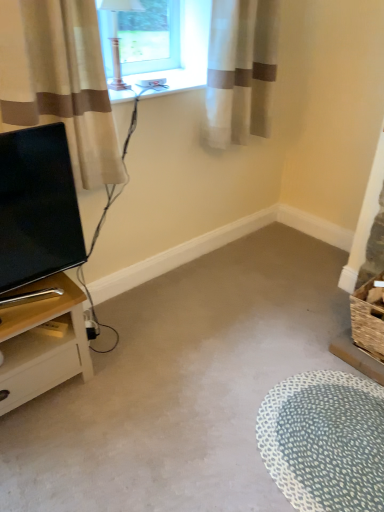
Question: From the image's perspective, is matte black tv at left located above or below white dotted rug at lower right?

Choices:
 (A) above
 (B) below

Answer: (A)

Question: Is point (19, 240) closer or farther from the camera than point (327, 395)?

Choices:
 (A) closer
 (B) farther

Answer: (A)

Question: Which of these objects is positioned farthest from the matte black tv at left?

Choices:
 (A) white dotted rug at lower right
 (B) beige fabric curtain at left, the first curtain positioned from the front
 (C) carpet at center
 (D) white sheer curtain at upper right, which is counted as the 2th curtain, starting from the front
 (E) light wood nightstand at left

Answer: (A)

Question: Which object is positioned closest to the beige fabric curtain at left, acting as the second curtain starting from the back?

Choices:
 (A) light wood nightstand at left
 (B) white sheer curtain at upper right, the 2th curtain when ordered from left to right
 (C) carpet at center
 (D) white plastic window sill at upper center
 (E) white dotted rug at lower right

Answer: (D)